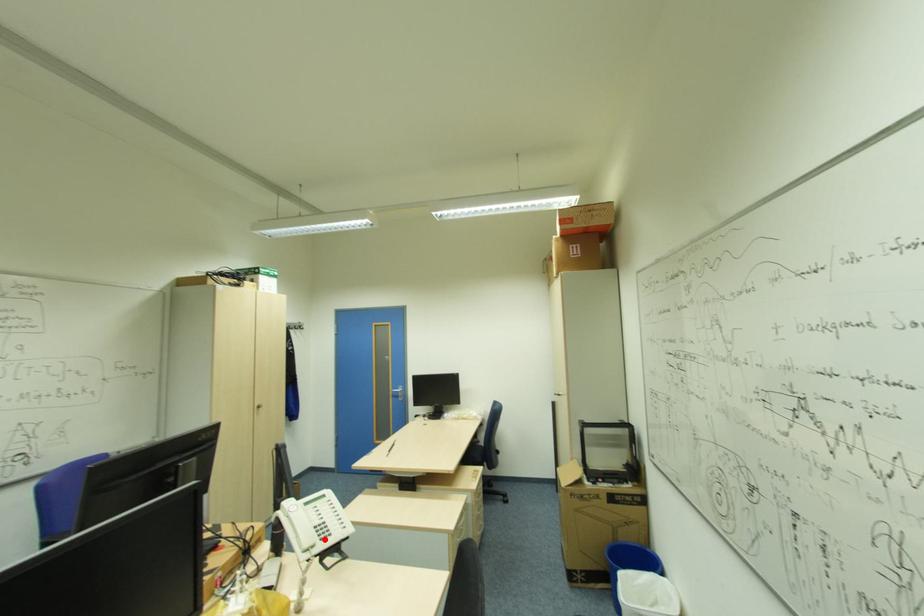
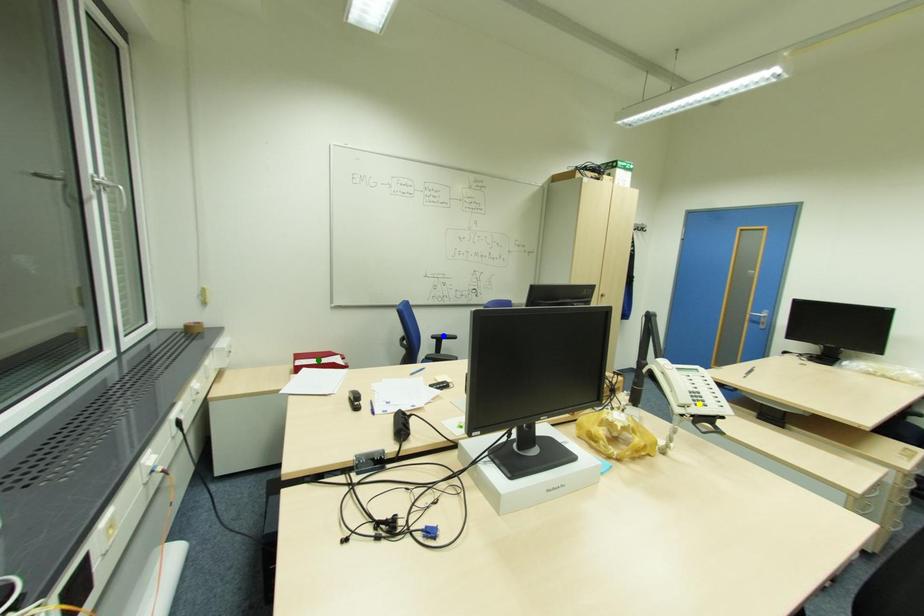
Question: I am providing you with two images of the same scene from different viewpoints. A red point is marked on the first image. You are given multiple points on the second image. Can you choose the point in image 2 that corresponds to the point in image 1?

Choices:
 (A) green point
 (B) yellow point
 (C) blue point

Answer: (B)